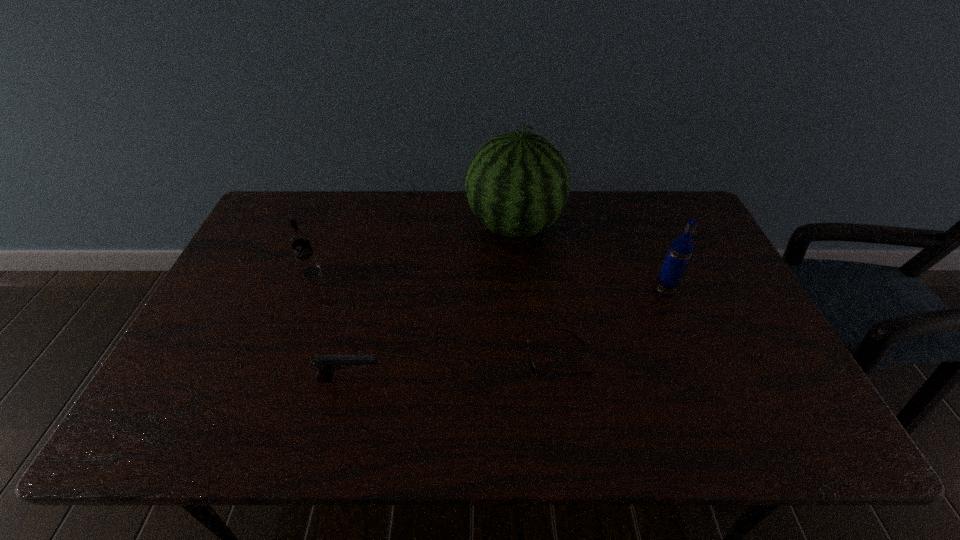
The width and height of the screenshot is (960, 540). In order to click on the tallest object in this screenshot , I will do `click(517, 184)`.

At what (x,y) coordinates should I click in order to perform the action: click on watermelon. Please return your answer as a coordinate pair (x, y). The height and width of the screenshot is (540, 960). Looking at the image, I should click on (517, 184).

The width and height of the screenshot is (960, 540). What are the coordinates of `the right vodka` in the screenshot? It's located at (680, 250).

You are a GUI agent. You are given a task and a screenshot of the screen. Output one action in this format:
    pyautogui.click(x=<x>, y=<y>)
    Task: Click on the third nearest object
    Image resolution: width=960 pixels, height=540 pixels.
    Given the screenshot: What is the action you would take?
    pyautogui.click(x=680, y=250)

Where is `the shorter vodka`? Image resolution: width=960 pixels, height=540 pixels. the shorter vodka is located at coordinates (299, 240).

Identify the location of the farther vodka. Image resolution: width=960 pixels, height=540 pixels. (299, 240).

You are a GUI agent. You are given a task and a screenshot of the screen. Output one action in this format:
    pyautogui.click(x=<x>, y=<y>)
    Task: Click on the pistol
    The width and height of the screenshot is (960, 540).
    Given the screenshot: What is the action you would take?
    pyautogui.click(x=327, y=364)

Locate an element on the screen. This screenshot has width=960, height=540. the second shortest object is located at coordinates (327, 364).

The image size is (960, 540). Find the location of `sunglasses`. sunglasses is located at coordinates (531, 366).

Identify the location of vacant space located 0.310m on the left of the tallest object. Image resolution: width=960 pixels, height=540 pixels. (372, 227).